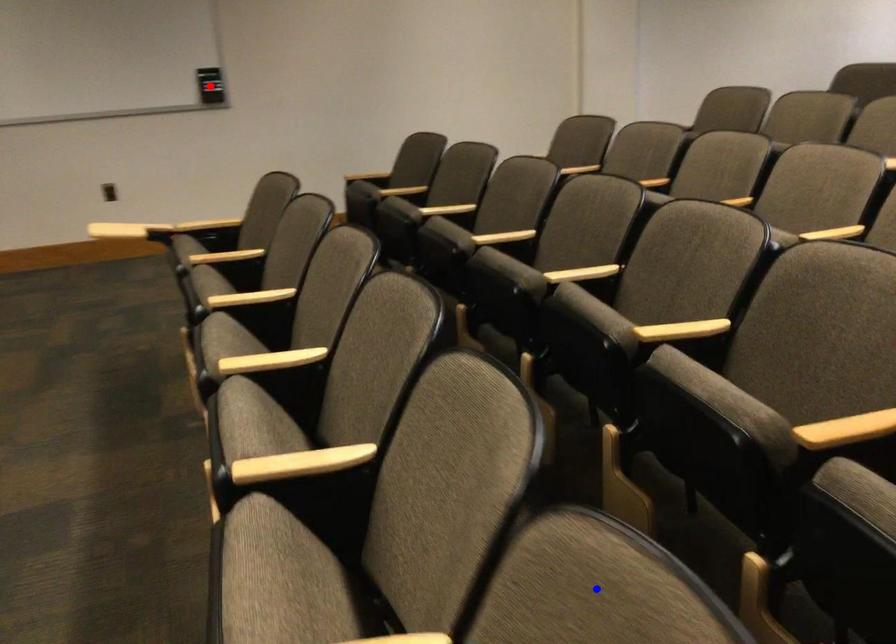
Question: In the image, two points are highlighted. Which point is nearer to the camera? Reply with the corresponding letter.

Choices:
 (A) blue point
 (B) red point

Answer: (A)